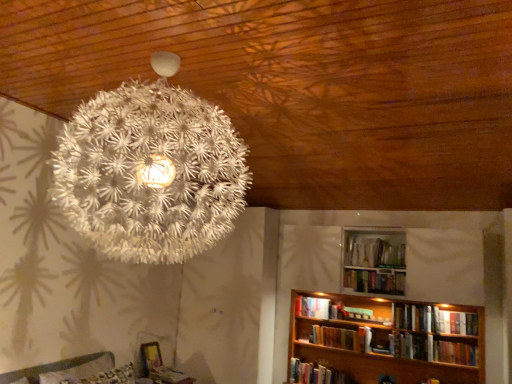
Question: Can you confirm if hardcover book at center, arranged as the fifth book when viewed from the left, is wider than white matte bookshelf at lower right, which is the second book in left-to-right order?

Choices:
 (A) yes
 (B) no

Answer: (B)

Question: Is hardcover book at center, the fourth book when ordered from right to left, not inside white matte bookshelf at lower right, arranged as the 7th book when viewed from the right?

Choices:
 (A) no
 (B) yes

Answer: (B)

Question: Does hardcover book at center, the fourth book when ordered from right to left, have a lesser width compared to white matte bookshelf at lower right, arranged as the 7th book when viewed from the right?

Choices:
 (A) yes
 (B) no

Answer: (A)

Question: Considering the relative sizes of hardcover book at center, the fourth book when ordered from right to left, and white matte bookshelf at lower right, which is the second book in left-to-right order, in the image provided, is hardcover book at center, the fourth book when ordered from right to left, smaller than white matte bookshelf at lower right, which is the second book in left-to-right order,?

Choices:
 (A) yes
 (B) no

Answer: (A)

Question: Is the depth of hardcover book at center, the fourth book when ordered from right to left, greater than that of white matte bookshelf at lower right, which is the second book in left-to-right order?

Choices:
 (A) no
 (B) yes

Answer: (A)

Question: Considering their positions, is hardcover book at center, the fifth book when ordered from right to left, located in front of or behind white matte bookshelf at lower right, which is the second book in left-to-right order?

Choices:
 (A) behind
 (B) front

Answer: (B)

Question: From the image's perspective, is hardcover book at center, the fifth book when ordered from right to left, located above or below white matte bookshelf at lower right, arranged as the 7th book when viewed from the right?

Choices:
 (A) above
 (B) below

Answer: (B)

Question: Considering the positions of hardcover book at center, the fifth book when ordered from right to left, and white matte bookshelf at lower right, arranged as the 7th book when viewed from the right, in the image, is hardcover book at center, the fifth book when ordered from right to left, wider or thinner than white matte bookshelf at lower right, arranged as the 7th book when viewed from the right,?

Choices:
 (A) thin
 (B) wide

Answer: (A)

Question: Is point (350, 339) positioned closer to the camera than point (324, 304)?

Choices:
 (A) closer
 (B) farther

Answer: (A)

Question: Do you think white matte bookshelf at lower right, the 3th book positioned from the left, is within hardcover book at center, the fourth book when ordered from right to left, or outside of it?

Choices:
 (A) outside
 (B) inside

Answer: (A)

Question: From the image's perspective, is white matte bookshelf at lower right, the sixth book viewed from the right, located above or below hardcover book at center, the fourth book when ordered from right to left?

Choices:
 (A) above
 (B) below

Answer: (B)

Question: Considering the positions of white matte bookshelf at lower right, the 3th book positioned from the left, and hardcover book at center, arranged as the fifth book when viewed from the left, in the image, is white matte bookshelf at lower right, the 3th book positioned from the left, bigger or smaller than hardcover book at center, arranged as the fifth book when viewed from the left,?

Choices:
 (A) big
 (B) small

Answer: (A)

Question: Relative to hardcover book at center, the fourth book when ordered from right to left, is white matte bookshelf at lower right, the sixth book viewed from the right, in front or behind?

Choices:
 (A) behind
 (B) front

Answer: (B)

Question: Considering the positions of white matte bookshelf at lower right, arranged as the 7th book when viewed from the right, and white matte bookshelf at lower right, the sixth book viewed from the right, in the image, is white matte bookshelf at lower right, arranged as the 7th book when viewed from the right, taller or shorter than white matte bookshelf at lower right, the sixth book viewed from the right,?

Choices:
 (A) tall
 (B) short

Answer: (B)

Question: Is white matte bookshelf at lower right, arranged as the 7th book when viewed from the right, in front of or behind white matte bookshelf at lower right, the sixth book viewed from the right, in the image?

Choices:
 (A) front
 (B) behind

Answer: (B)